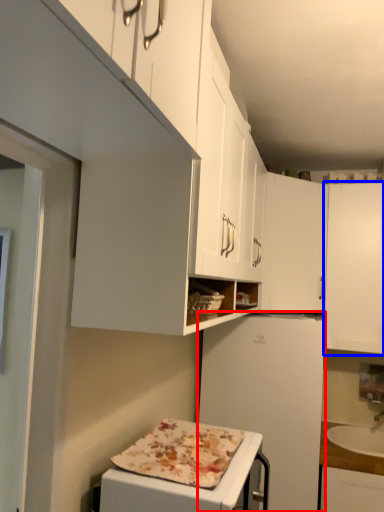
Question: Which point is further to the camera, refrigerator (highlighted by a red box) or cabinetry (highlighted by a blue box)?

Choices:
 (A) refrigerator
 (B) cabinetry

Answer: (B)